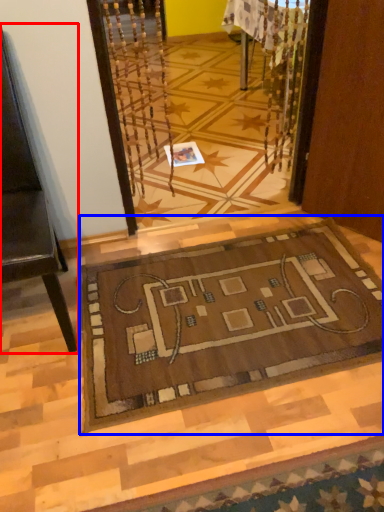
Question: Which of the following is the farthest to the observer, furniture (highlighted by a red box) or mat (highlighted by a blue box)?

Choices:
 (A) furniture
 (B) mat

Answer: (B)